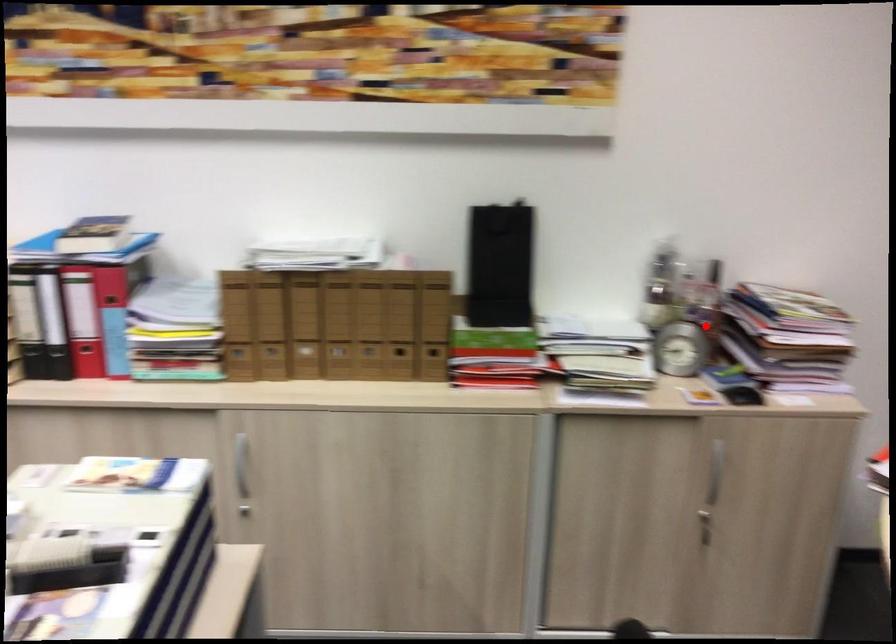
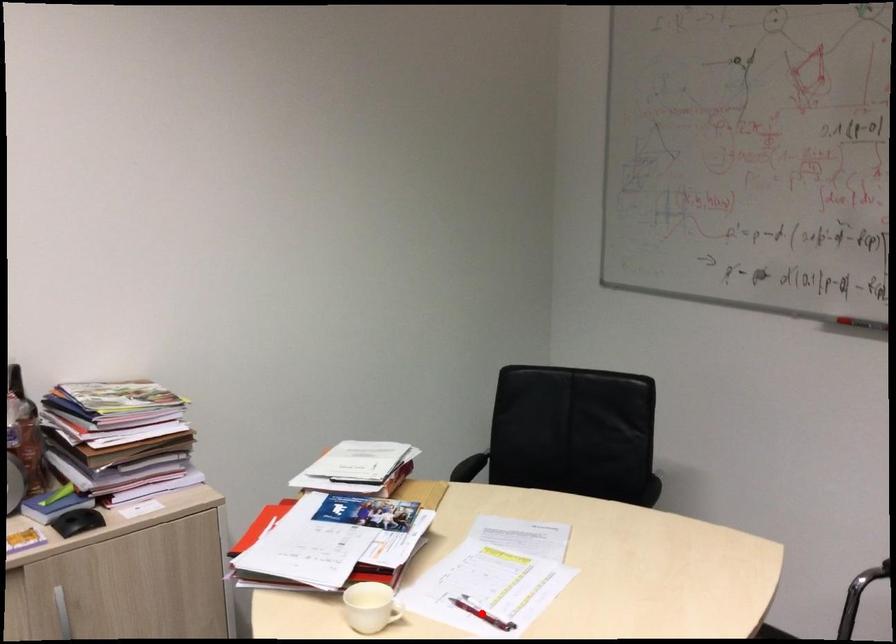
I am providing you with two images of the same scene from different viewpoints. A red point is marked on the first image and another point is marked on the second image. Do the highlighted points in image1 and image2 indicate the same real-world spot?

No